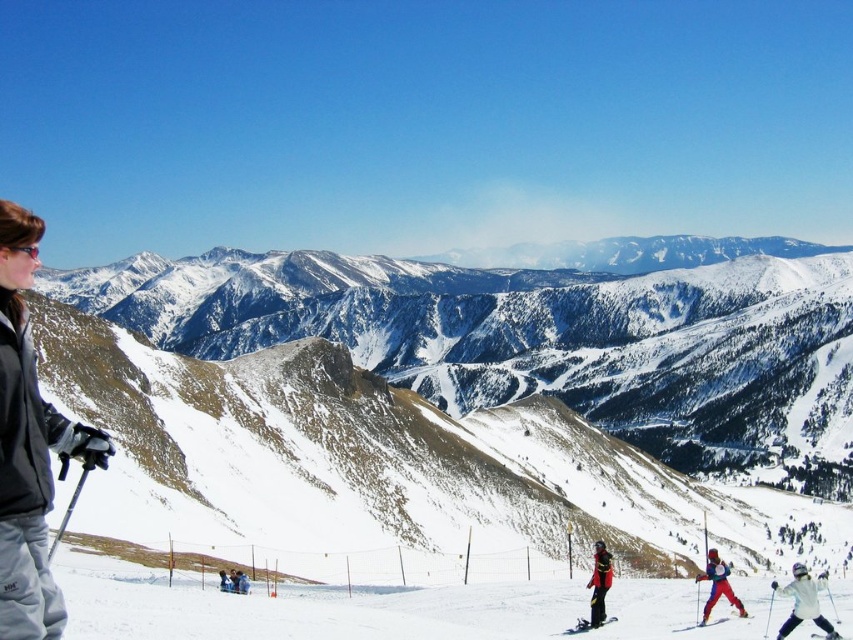
Can you confirm if white matte ski suit at lower right is thinner than matte black ski at lower center?

No, white matte ski suit at lower right is not thinner than matte black ski at lower center.

Is white matte ski suit at lower right positioned behind matte black ski at lower center?

That is False.

Where is `white matte ski suit at lower right`? This screenshot has height=640, width=853. white matte ski suit at lower right is located at coordinates (804, 602).

This screenshot has width=853, height=640. Describe the element at coordinates (587, 625) in the screenshot. I see `matte black ski at lower center` at that location.

Does matte black ski at lower center have a larger size compared to matte black goggles at upper left?

Correct, matte black ski at lower center is larger in size than matte black goggles at upper left.

The height and width of the screenshot is (640, 853). What do you see at coordinates (587, 625) in the screenshot?
I see `matte black ski at lower center` at bounding box center [587, 625].

At what (x,y) coordinates should I click in order to perform the action: click on matte black ski at lower center. Please return your answer as a coordinate pair (x, y). This screenshot has height=640, width=853. Looking at the image, I should click on (587, 625).

Is snowy mountain at center above matte black goggles at upper left?

Correct, snowy mountain at center is located above matte black goggles at upper left.

Is snowy mountain at center below matte black goggles at upper left?

Incorrect, snowy mountain at center is not positioned below matte black goggles at upper left.

Is point (825, 465) closer to camera compared to point (9, 244)?

No, (825, 465) is behind (9, 244).

Where is `snowy mountain at center`? snowy mountain at center is located at coordinates (463, 380).